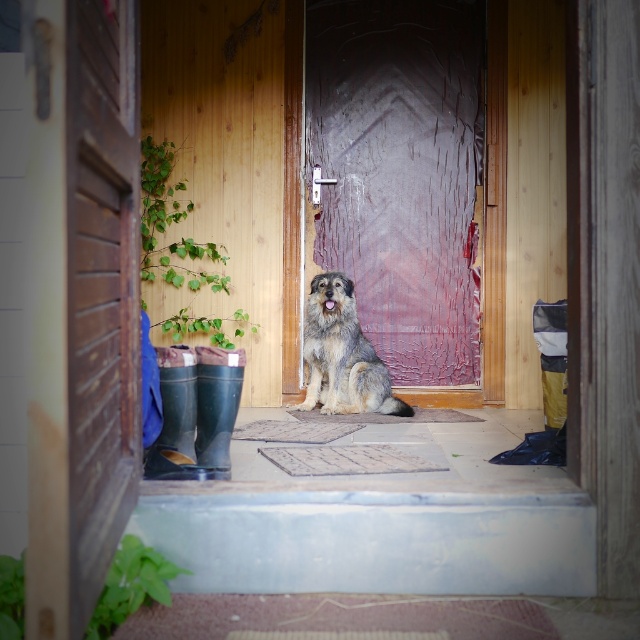
The height and width of the screenshot is (640, 640). Identify the location of wooden screen door at center. tap(401, 172).

Does wooden screen door at center have a larger size compared to gray-furred dog at center?

Correct, wooden screen door at center is larger in size than gray-furred dog at center.

Who is more distant from viewer, (436, 164) or (305, 339)?

The point (436, 164) is behind.

Locate an element on the screen. The height and width of the screenshot is (640, 640). wooden screen door at center is located at coordinates (401, 172).

Is wooden screen door at center below rustic wood door at left?

Actually, wooden screen door at center is above rustic wood door at left.

Does wooden screen door at center appear over rustic wood door at left?

Indeed, wooden screen door at center is positioned over rustic wood door at left.

Does point (456, 225) lie behind point (84, 138)?

Yes, point (456, 225) is farther from viewer.

This screenshot has width=640, height=640. Find the location of `wooden screen door at center`. wooden screen door at center is located at coordinates (401, 172).

Can you confirm if rustic wood door at left is thinner than gray-furred dog at center?

Yes, rustic wood door at left is thinner than gray-furred dog at center.

Image resolution: width=640 pixels, height=640 pixels. Describe the element at coordinates (100, 288) in the screenshot. I see `rustic wood door at left` at that location.

The width and height of the screenshot is (640, 640). Find the location of `rustic wood door at left`. rustic wood door at left is located at coordinates (100, 288).